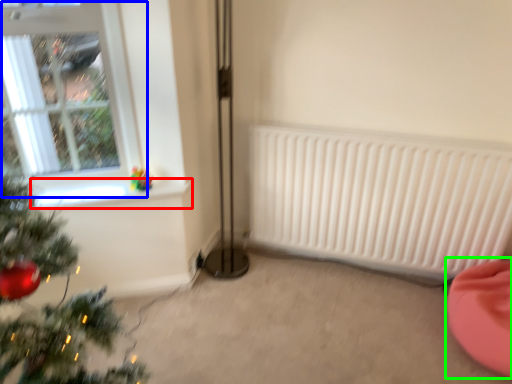
Question: Considering the real-world distances, which object is closest to window sill (highlighted by a red box)? window (highlighted by a blue box) or bean bag chair (highlighted by a green box).

Choices:
 (A) window
 (B) bean bag chair

Answer: (A)